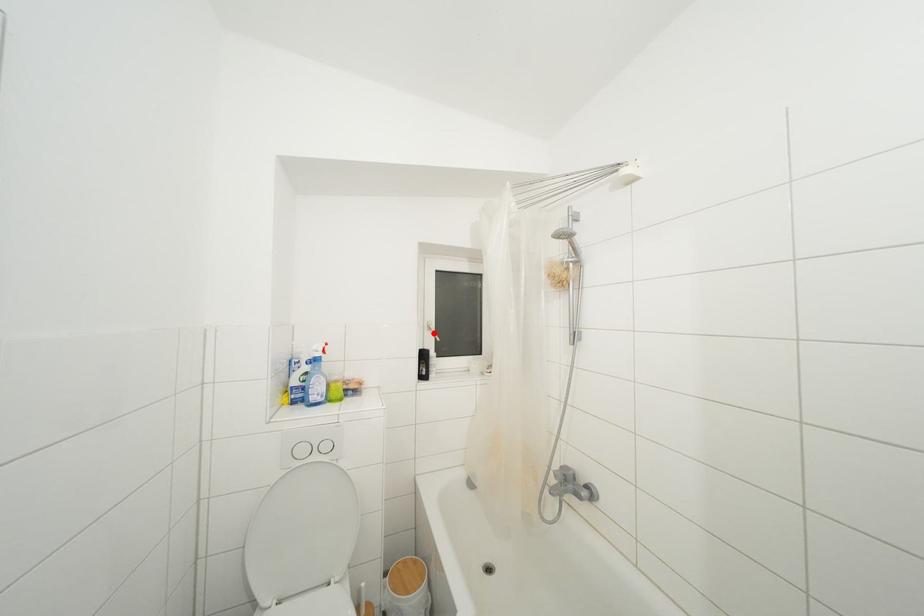
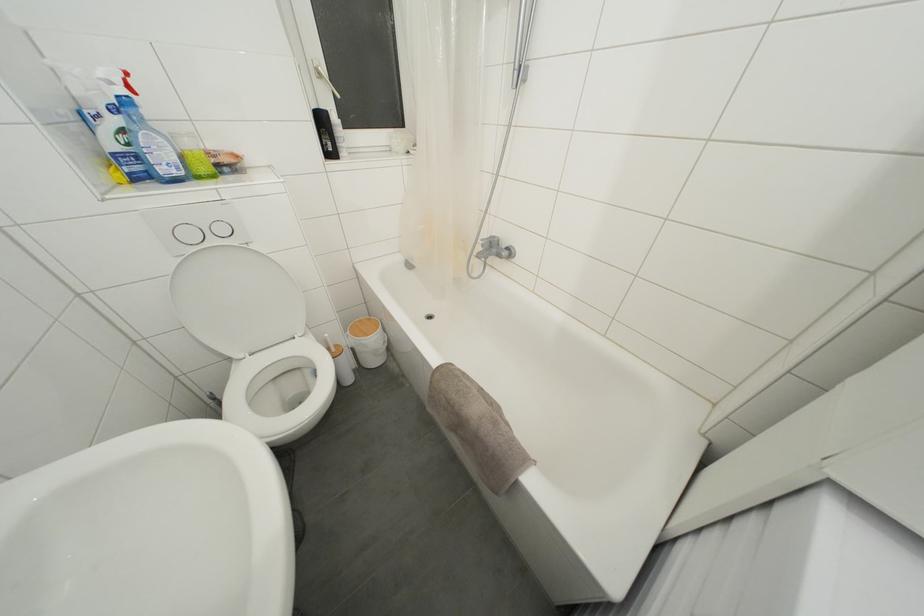
The point at the highlighted location is marked in the first image. Where is the corresponding point in the second image?

(323, 79)